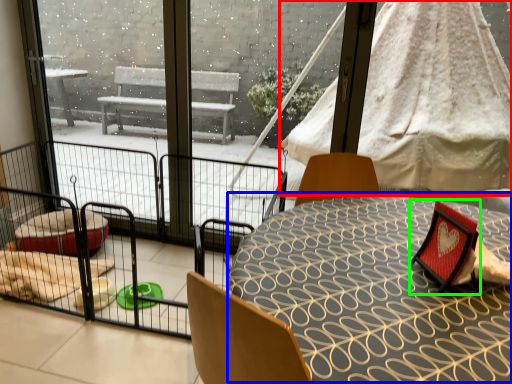
Question: Considering the real-world distances, which object is closest to canopy bed (highlighted by a red box)? round table (highlighted by a blue box) or armchair (highlighted by a green box).

Choices:
 (A) round table
 (B) armchair

Answer: (A)